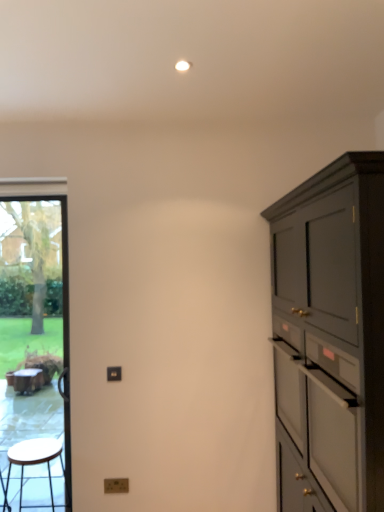
Question: Can you confirm if transparent glass door at left is smaller than white matte drawer at right?

Choices:
 (A) no
 (B) yes

Answer: (A)

Question: From a real-world perspective, is transparent glass door at left positioned under white matte drawer at right based on gravity?

Choices:
 (A) no
 (B) yes

Answer: (A)

Question: From the image's perspective, is transparent glass door at left on top of white matte drawer at right?

Choices:
 (A) yes
 (B) no

Answer: (B)

Question: Can you confirm if transparent glass door at left is thinner than white matte drawer at right?

Choices:
 (A) yes
 (B) no

Answer: (A)

Question: Is transparent glass door at left wider than white matte drawer at right?

Choices:
 (A) yes
 (B) no

Answer: (B)

Question: Is transparent glass door at left facing away from white matte drawer at right?

Choices:
 (A) no
 (B) yes

Answer: (A)

Question: Does wooden stool at left have a smaller size compared to white matte drawer at right?

Choices:
 (A) no
 (B) yes

Answer: (B)

Question: Does wooden stool at left have a lesser height compared to white matte drawer at right?

Choices:
 (A) yes
 (B) no

Answer: (A)

Question: Considering the relative positions of wooden stool at left and white matte drawer at right in the image provided, is wooden stool at left to the right of white matte drawer at right from the viewer's perspective?

Choices:
 (A) yes
 (B) no

Answer: (B)

Question: Is wooden stool at left positioned beyond the bounds of white matte drawer at right?

Choices:
 (A) no
 (B) yes

Answer: (B)

Question: Could you tell me if wooden stool at left is turned towards white matte drawer at right?

Choices:
 (A) yes
 (B) no

Answer: (B)

Question: From the image's perspective, does wooden stool at left appear lower than white matte drawer at right?

Choices:
 (A) yes
 (B) no

Answer: (A)

Question: Does white matte drawer at right have a lesser width compared to transparent glass door at left?

Choices:
 (A) no
 (B) yes

Answer: (A)